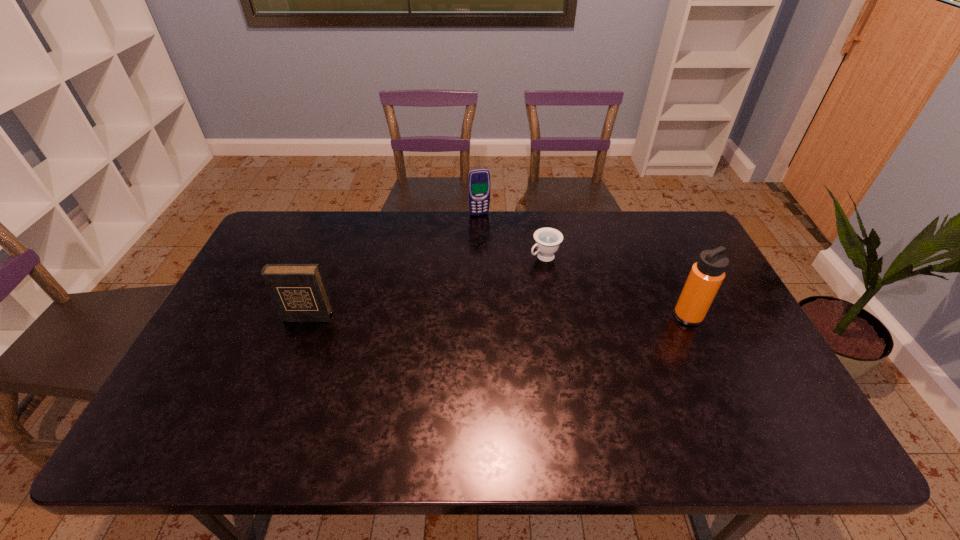
This screenshot has width=960, height=540. I want to click on vacant point located between the third object from right to left and the teacup, so click(x=512, y=235).

Where is `free area in between the diary and the tallest object`? The height and width of the screenshot is (540, 960). free area in between the diary and the tallest object is located at coordinates (497, 316).

You are a GUI agent. You are given a task and a screenshot of the screen. Output one action in this format:
    pyautogui.click(x=<x>, y=<y>)
    Task: Click on the vacant area that lies between the cellular telephone and the shortest object
    The height and width of the screenshot is (540, 960).
    Given the screenshot: What is the action you would take?
    pyautogui.click(x=512, y=235)

I want to click on free space between the farthest object and the leftmost object, so click(394, 266).

Identify which object is located as the third nearest to the diary. Please provide its 2D coordinates. Your answer should be formatted as a tuple, i.e. [(x, y)], where the tuple contains the x and y coordinates of a point satisfying the conditions above.

[(707, 274)]

Identify which object is the second closest to the leftmost object. Please provide its 2D coordinates. Your answer should be formatted as a tuple, i.e. [(x, y)], where the tuple contains the x and y coordinates of a point satisfying the conditions above.

[(547, 240)]

In order to click on vacant space that satisfies the following two spatial constraints: 1. on the front side of the cellular telephone; 2. on the right side of the tallest object in this screenshot , I will do 479,316.